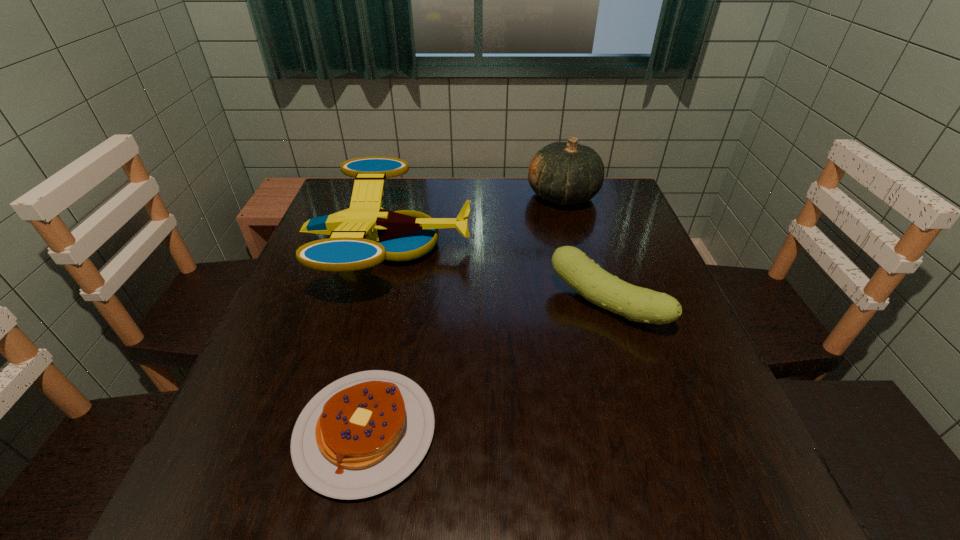
Locate an element on the screen. This screenshot has width=960, height=540. the tallest object is located at coordinates (566, 173).

In order to click on drone in this screenshot , I will do `click(364, 235)`.

Find the location of a particular element. This screenshot has height=540, width=960. the third tallest object is located at coordinates tap(574, 267).

This screenshot has height=540, width=960. In order to click on the shortest object in this screenshot , I will do `click(361, 435)`.

This screenshot has width=960, height=540. In order to click on pancake in this screenshot , I will do `click(361, 435)`.

Find the location of a particular element. free space located on the front of the tallest object is located at coordinates (594, 311).

Locate an element on the screen. free region located 0.330m at the cockpit of the third shortest object is located at coordinates (605, 246).

This screenshot has width=960, height=540. I want to click on vacant space located 0.150m on the left of the cucumber, so click(481, 305).

Find the location of a particular element. Image resolution: width=960 pixels, height=540 pixels. vacant area situated 0.100m on the right of the pancake is located at coordinates (496, 431).

Find the location of `gourd present at the far edge`. gourd present at the far edge is located at coordinates point(566,173).